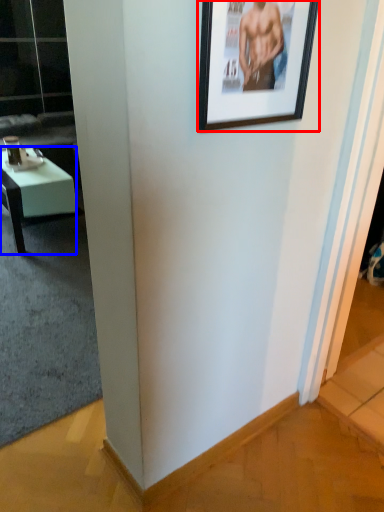
Question: Which object is further to the camera taking this photo, picture frame (highlighted by a red box) or desk (highlighted by a blue box)?

Choices:
 (A) picture frame
 (B) desk

Answer: (B)